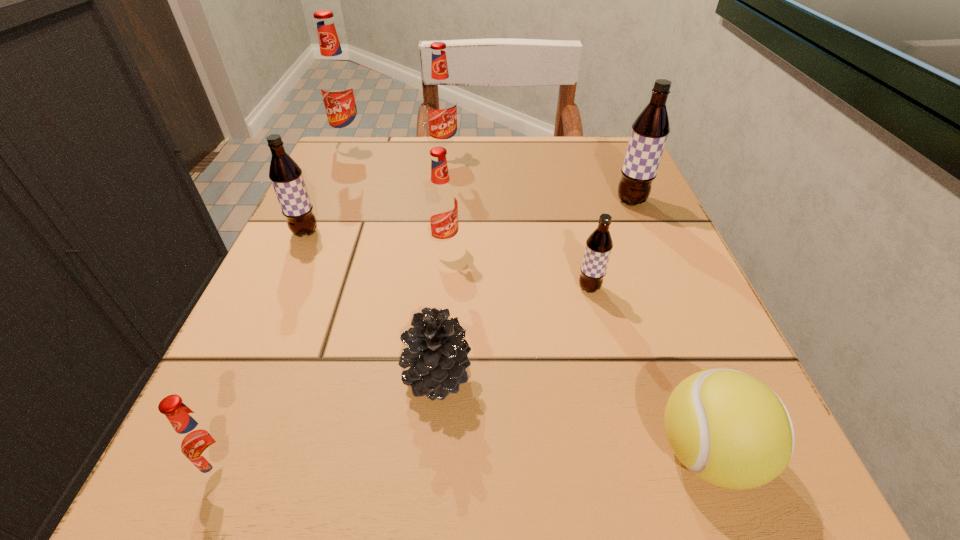
Locate an element on the screen. This screenshot has height=540, width=960. the smallest red root beer is located at coordinates (202, 441).

At what (x,y) coordinates should I click in order to perform the action: click on the nearest red root beer. Please return your answer as a coordinate pair (x, y). Image resolution: width=960 pixels, height=540 pixels. Looking at the image, I should click on click(x=202, y=441).

Find the location of a particular element. brown pinecone is located at coordinates (437, 354).

The image size is (960, 540). I want to click on yellow tennis ball, so click(x=728, y=428).

This screenshot has height=540, width=960. Identify the location of free point located on the front of the biggest red root beer. (337, 175).

At what (x,y) coordinates should I click in order to perform the action: click on free location located on the left of the third smallest red root beer. Please return your answer as a coordinate pair (x, y). Looking at the image, I should click on pos(332,151).

The height and width of the screenshot is (540, 960). What are the coordinates of `vacant area situated on the left of the rightmost brown root beer` in the screenshot? It's located at (438, 201).

Locate an element on the screen. vacant point located on the front of the second smallest red root beer is located at coordinates (438, 331).

This screenshot has width=960, height=540. I want to click on vacant space located on the right of the second farthest brown root beer, so click(353, 232).

At what (x,y) coordinates should I click in order to perform the action: click on vacant space positioned 0.220m on the left of the second nearest root beer. Please return your answer as a coordinate pair (x, y). Looking at the image, I should click on (434, 288).